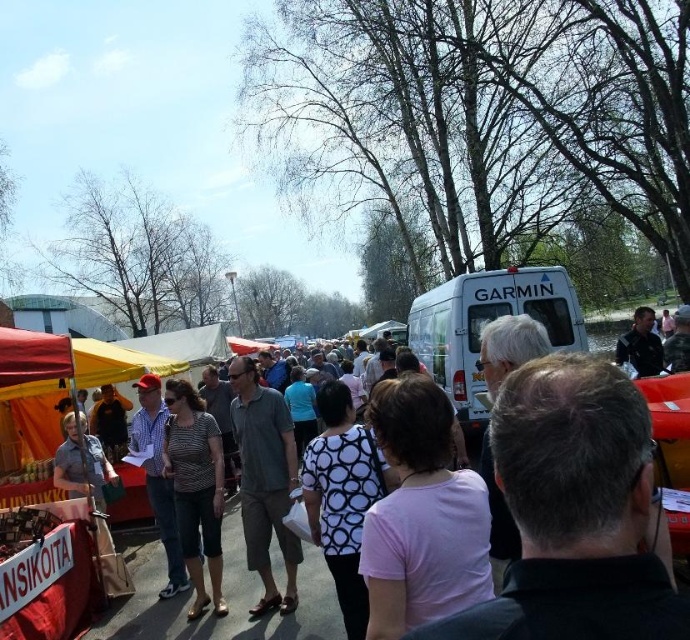
Is white matte van at upper center positioned behind striped fabric shirt at center?

Yes, white matte van at upper center is further from the viewer.

Describe the element at coordinates (486, 323) in the screenshot. The width and height of the screenshot is (690, 640). I see `white matte van at upper center` at that location.

I want to click on white matte van at upper center, so click(486, 323).